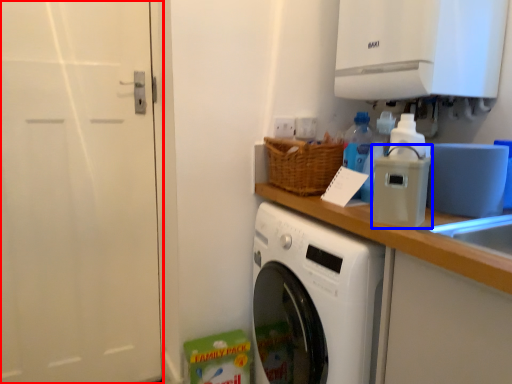
Question: Which point is further to the camera, screen door (highlighted by a red box) or appliance (highlighted by a blue box)?

Choices:
 (A) screen door
 (B) appliance

Answer: (A)